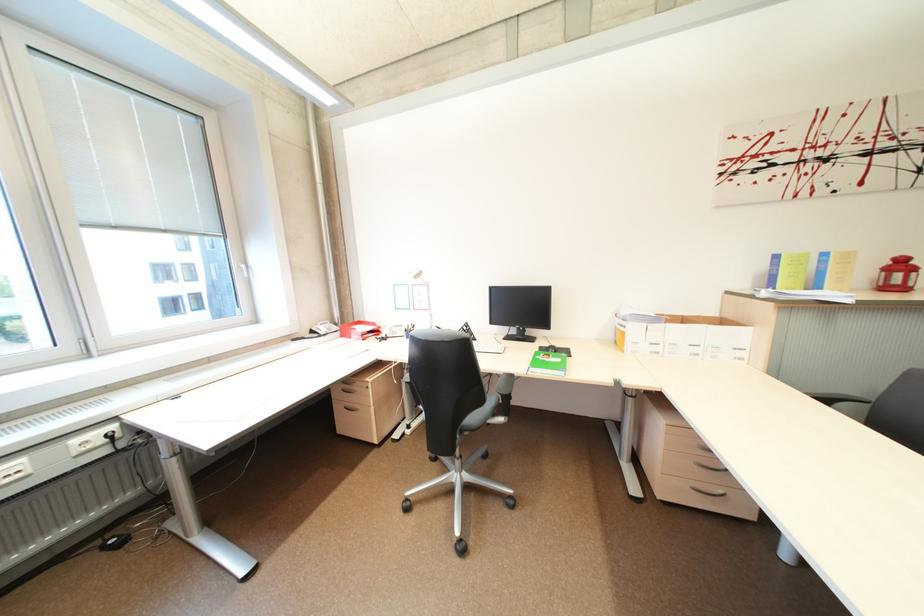
You are a GUI agent. You are given a task and a screenshot of the screen. Output one action in this format:
    pyautogui.click(x=<x>, y=<y>)
    Task: Click on the white window handle
    
    Given the screenshot: What is the action you would take?
    pyautogui.click(x=244, y=270)